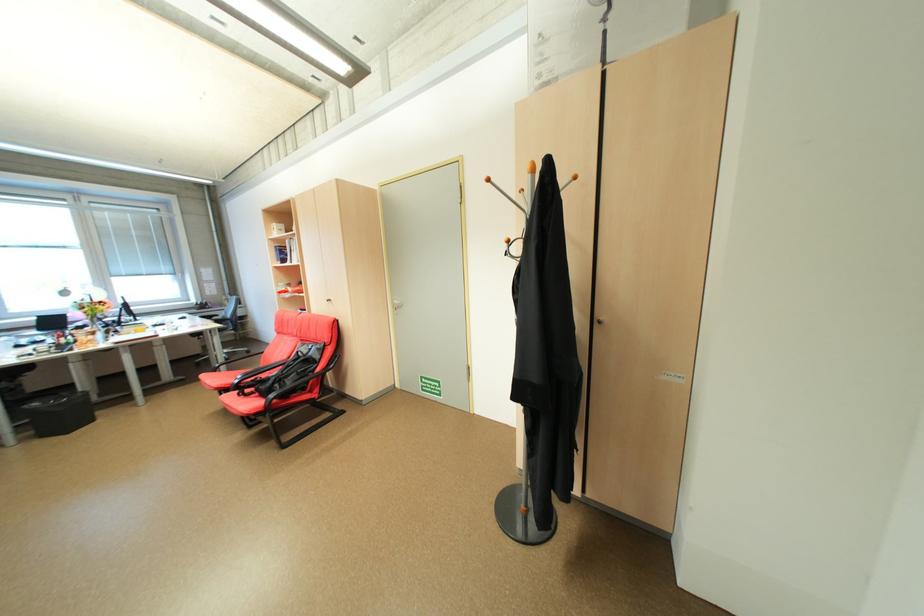
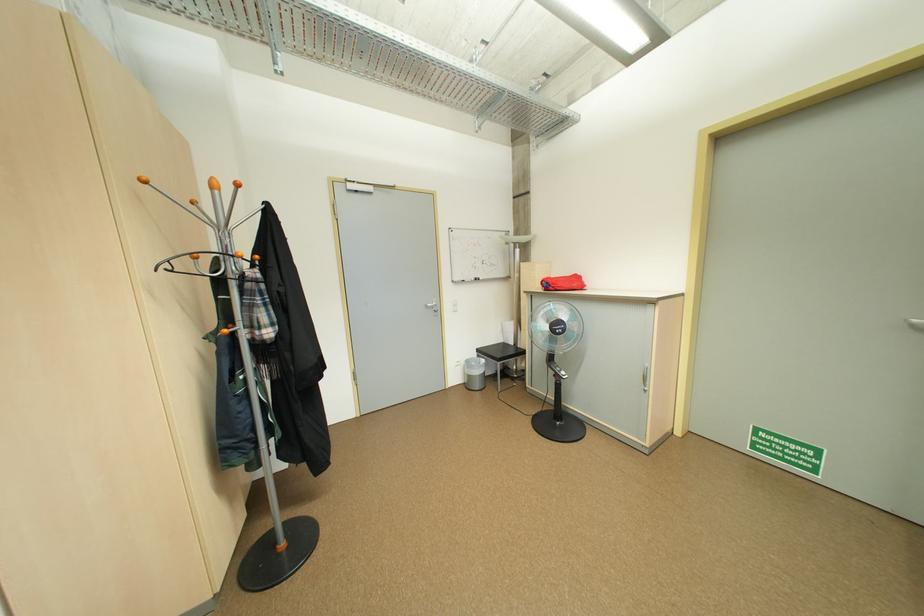
The point at (497, 180) is marked in the first image. Where is the corresponding point in the second image?

(247, 185)